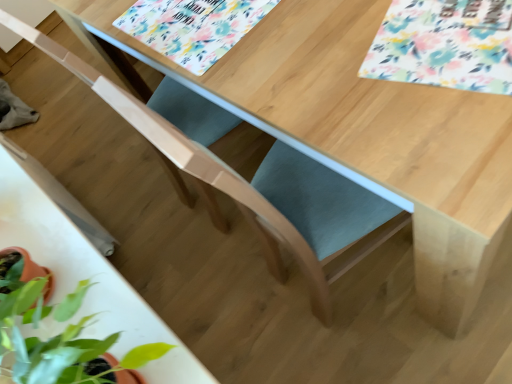
Question: Considering the relative positions of floral-patterned paper at upper right, the 2th flower positioned from the left, and white glossy round table at center in the image provided, is floral-patterned paper at upper right, the 2th flower positioned from the left, to the right of white glossy round table at center from the viewer's perspective?

Choices:
 (A) no
 (B) yes

Answer: (B)

Question: From a real-world perspective, is floral-patterned paper at upper right, the first flower from the right, beneath white glossy round table at center?

Choices:
 (A) yes
 (B) no

Answer: (A)

Question: Can you confirm if floral-patterned paper at upper right, the 2th flower positioned from the left, is shorter than white glossy round table at center?

Choices:
 (A) no
 (B) yes

Answer: (B)

Question: Can you confirm if floral-patterned paper at upper right, the 2th flower from the back, is taller than white glossy round table at center?

Choices:
 (A) yes
 (B) no

Answer: (B)

Question: Is floral-patterned paper at upper right, the 2th flower positioned from the left, to the left of white glossy round table at center from the viewer's perspective?

Choices:
 (A) no
 (B) yes

Answer: (A)

Question: Is floral-patterned paper at upper right, the first flower from the right, facing away from white glossy round table at center?

Choices:
 (A) yes
 (B) no

Answer: (B)

Question: Is white glossy round table at center smaller than floral-patterned paper at upper right, the first flower from the right?

Choices:
 (A) yes
 (B) no

Answer: (B)

Question: Is white glossy round table at center completely or partially outside of floral-patterned paper at upper right, the 2th flower positioned from the left?

Choices:
 (A) no
 (B) yes

Answer: (B)

Question: Does white glossy round table at center appear on the right side of floral-patterned paper at upper right, positioned as the first flower in front-to-back order?

Choices:
 (A) yes
 (B) no

Answer: (B)

Question: Is white glossy round table at center bigger than floral-patterned paper at upper right, the first flower from the right?

Choices:
 (A) no
 (B) yes

Answer: (B)

Question: Is white glossy round table at center directly adjacent to floral-patterned paper at upper right, the first flower from the right?

Choices:
 (A) no
 (B) yes

Answer: (A)

Question: From the image's perspective, does white glossy round table at center appear lower than floral-patterned paper at upper right, the first flower from the right?

Choices:
 (A) no
 (B) yes

Answer: (B)

Question: Considering the relative sizes of floral-patterned paper at upper right, the first flower from the right, and floral-patterned placemat at upper center, which appears as the first flower when viewed from the back, in the image provided, is floral-patterned paper at upper right, the first flower from the right, wider than floral-patterned placemat at upper center, which appears as the first flower when viewed from the back,?

Choices:
 (A) no
 (B) yes

Answer: (B)